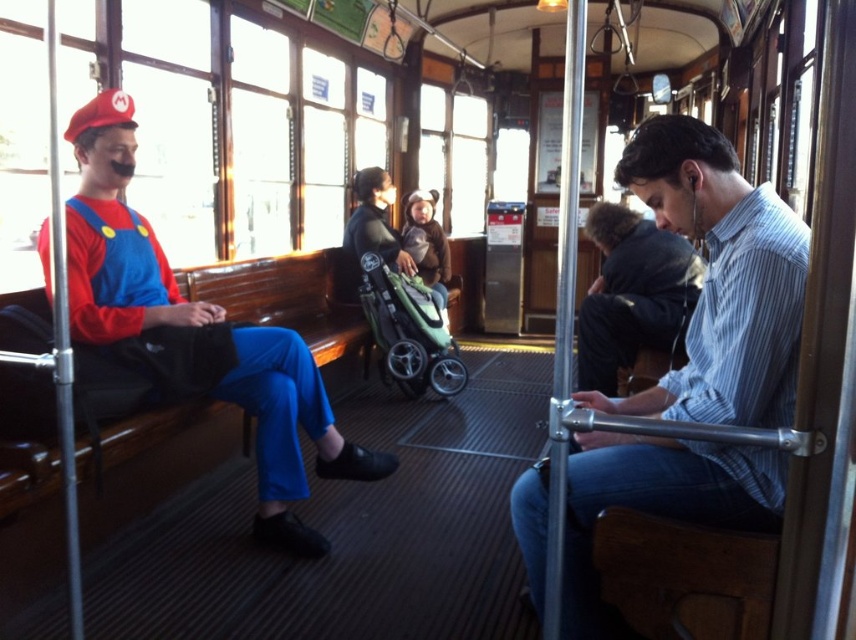
Based on the photo, you are a photographer inside the vintage tram and want to take a photo of both the striped cotton shirt at right and the green fabric stroller at center. Which object should you focus on first if you want to capture both in the same frame without moving the camera?

You should focus on the striped cotton shirt at right first because it is taller than the green fabric stroller at center, ensuring it fits within the frame when positioned properly.

You are a passenger in the vintage tram and want to exit through the door located behind the green fabric stroller at center. Can you walk directly to the door without moving around the matte blue jumpsuit at left?

The matte blue jumpsuit at left is in front of the green fabric stroller at center, so you would need to move around the matte blue jumpsuit at left to reach the door behind the green fabric stroller at center.